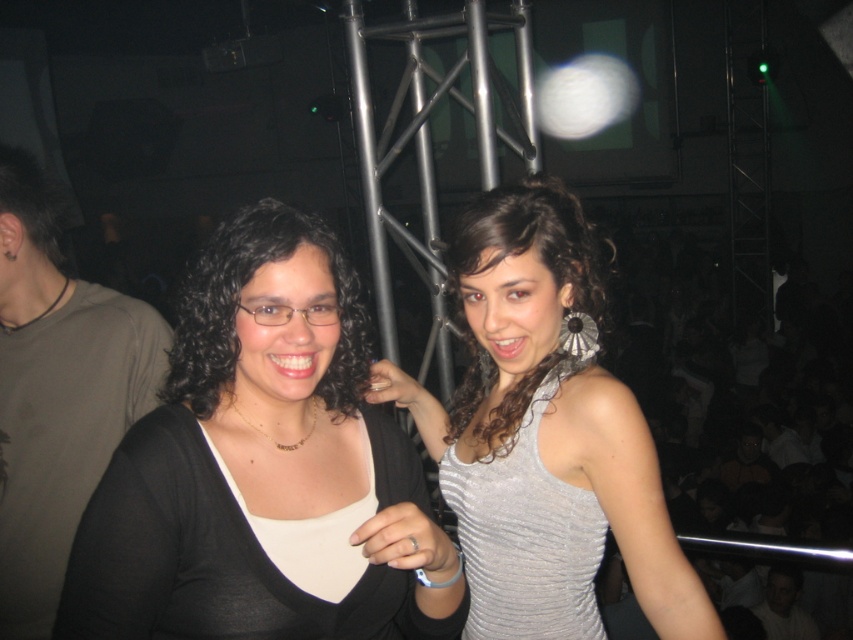
The height and width of the screenshot is (640, 853). What are the coordinates of `matte black shirt at center` in the screenshot? It's located at (252, 460).

Does matte black shirt at center have a smaller size compared to matte black hair at center?

No, matte black shirt at center is not smaller than matte black hair at center.

Does point (82, 618) lie behind point (357, 284)?

No, it is in front of (357, 284).

Where is `matte black shirt at center`? The height and width of the screenshot is (640, 853). matte black shirt at center is located at coordinates (252, 460).

Is matte black shirt at center taller than shiny silver dress at center?

No, matte black shirt at center is not taller than shiny silver dress at center.

I want to click on matte black shirt at center, so click(x=252, y=460).

You are a GUI agent. You are given a task and a screenshot of the screen. Output one action in this format:
    pyautogui.click(x=<x>, y=<y>)
    Task: Click on the matte black shirt at center
    The height and width of the screenshot is (640, 853).
    Given the screenshot: What is the action you would take?
    pyautogui.click(x=252, y=460)

Looking at this image, between matte black shirt at left and matte black hair at center, which one has more height?

With more height is matte black shirt at left.

Is matte black shirt at left shorter than matte black hair at center?

No.

Who is more distant from viewer, (82, 378) or (167, 397)?

The point (82, 378) is more distant.

Where is `matte black shirt at left`? The height and width of the screenshot is (640, 853). matte black shirt at left is located at coordinates (56, 394).